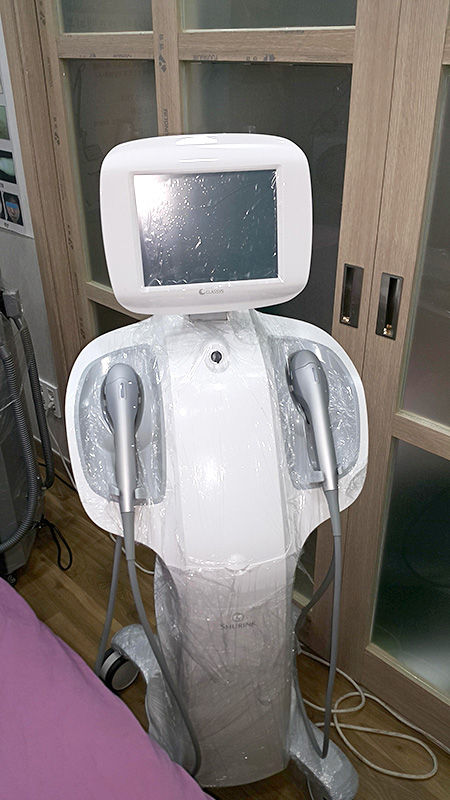
This screenshot has height=800, width=450. Identify the location of medical poster. (7, 142).